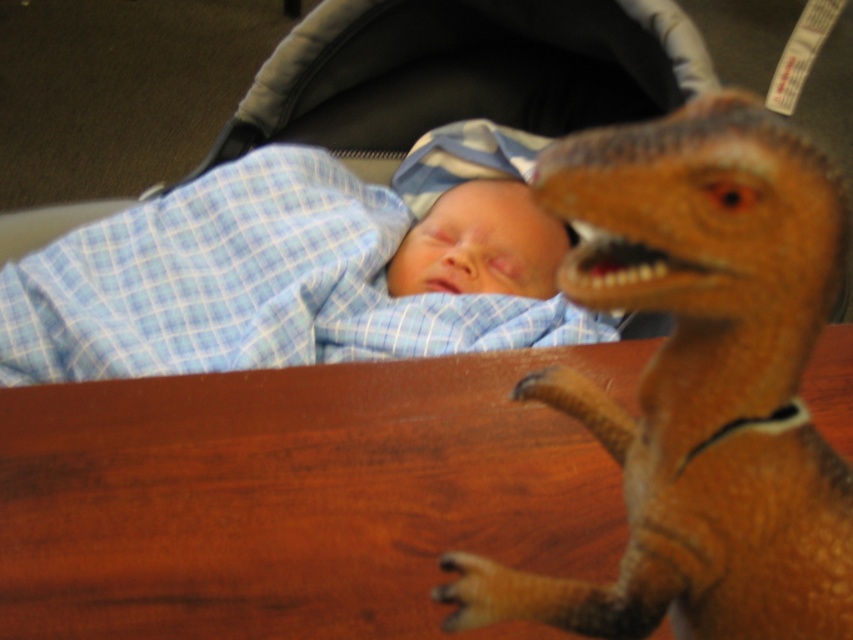
Is brown wood table at center to the left of brown textured dinosaur at center from the viewer's perspective?

Yes, brown wood table at center is to the left of brown textured dinosaur at center.

Can you confirm if brown wood table at center is smaller than brown textured dinosaur at center?

No.

Between point (148, 422) and point (773, 202), which one is positioned in front?

Positioned in front is point (773, 202).

Where is `brown wood table at center`? brown wood table at center is located at coordinates (297, 497).

Which is behind, point (294, 604) or point (338, 324)?

The point (338, 324) is more distant.

Does brown wood table at center come in front of blue checkered blanket at upper left?

Yes, brown wood table at center is in front of blue checkered blanket at upper left.

This screenshot has height=640, width=853. Identify the location of brown wood table at center. tap(297, 497).

Is brown textured dinosaur at center to the left of blue checkered blanket at upper left from the viewer's perspective?

Incorrect, brown textured dinosaur at center is not on the left side of blue checkered blanket at upper left.

At what (x,y) coordinates should I click in order to perform the action: click on brown textured dinosaur at center. Please return your answer as a coordinate pair (x, y). This screenshot has height=640, width=853. Looking at the image, I should click on 699,381.

I want to click on brown textured dinosaur at center, so click(x=699, y=381).

At what (x,y) coordinates should I click in order to perform the action: click on brown textured dinosaur at center. Please return your answer as a coordinate pair (x, y). Looking at the image, I should click on (699, 381).